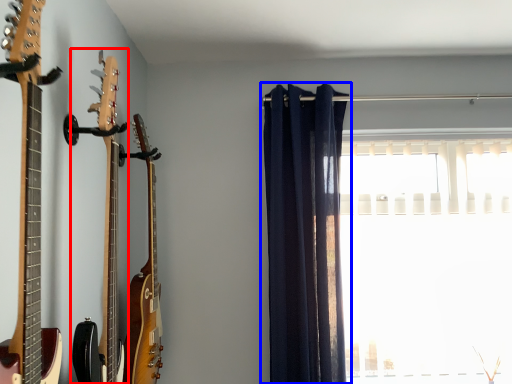
Question: Among these objects, which one is nearest to the camera, guitar (highlighted by a red box) or curtain (highlighted by a blue box)?

Choices:
 (A) guitar
 (B) curtain

Answer: (A)